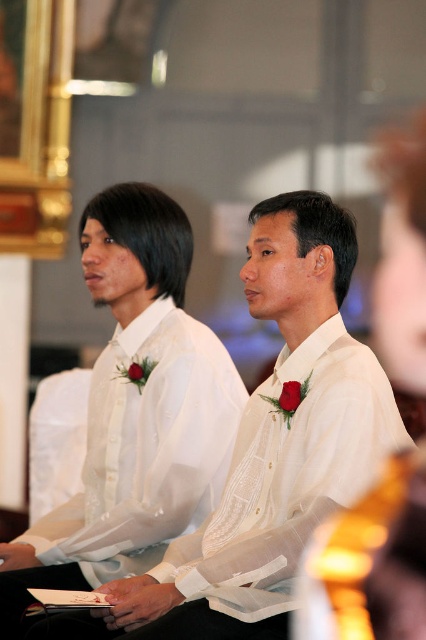
Question: Which of the following is the closest to the observer?

Choices:
 (A) (173, 236)
 (B) (238, 477)

Answer: (B)

Question: Is white embroidered shirt at center smaller than white sheer shirt at center?

Choices:
 (A) yes
 (B) no

Answer: (A)

Question: Which point appears farthest from the camera in this image?

Choices:
 (A) (238, 468)
 (B) (192, 428)

Answer: (B)

Question: Among these points, which one is nearest to the camera?

Choices:
 (A) (62, 544)
 (B) (250, 561)

Answer: (B)

Question: Can you confirm if white embroidered shirt at center is smaller than white sheer shirt at center?

Choices:
 (A) no
 (B) yes

Answer: (B)

Question: Can you confirm if white embroidered shirt at center is smaller than white sheer shirt at center?

Choices:
 (A) yes
 (B) no

Answer: (A)